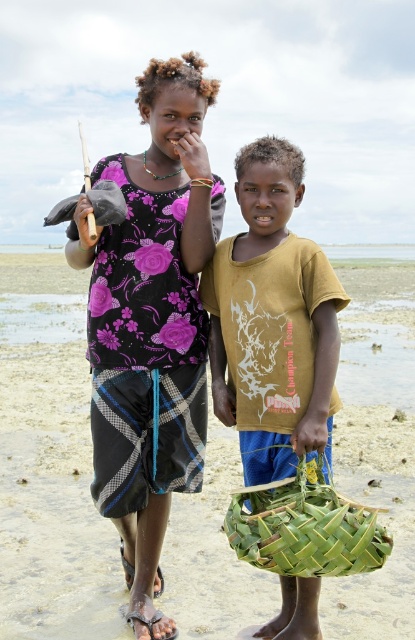
This screenshot has height=640, width=415. What do you see at coordinates (151, 316) in the screenshot?
I see `purple floral shirt at center` at bounding box center [151, 316].

Where is `purple floral shirt at center`? The height and width of the screenshot is (640, 415). purple floral shirt at center is located at coordinates (151, 316).

I want to click on purple floral shirt at center, so click(x=151, y=316).

Which of these two, purple floral shirt at center or brown woven sandal at lower center, stands shorter?

Standing shorter between the two is brown woven sandal at lower center.

Who is more distant from viewer, (182, 147) or (158, 637)?

The point (182, 147) is more distant.

Where is `purple floral shirt at center`? The width and height of the screenshot is (415, 640). purple floral shirt at center is located at coordinates (151, 316).

Is point (82, 564) less distant than point (161, 572)?

No, (82, 564) is further to viewer.

Between point (390, 404) and point (156, 568), which one is positioned in front?

Positioned in front is point (156, 568).

Is point (334, 481) positioned after point (122, 554)?

Yes.

The width and height of the screenshot is (415, 640). I want to click on green woven basket at center, so point(49,461).